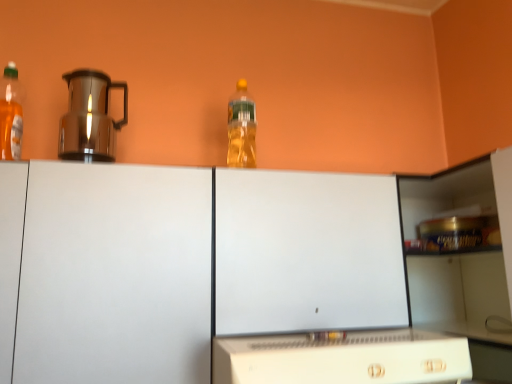
Question: Considering the positions of white matte cabinet at center and translucent plastic bottle at upper center, placed as the 1th bottle when sorted from right to left, in the image, is white matte cabinet at center taller or shorter than translucent plastic bottle at upper center, placed as the 1th bottle when sorted from right to left,?

Choices:
 (A) short
 (B) tall

Answer: (B)

Question: Looking at their shapes, would you say white matte cabinet at center is wider or thinner than translucent plastic bottle at upper center, the first bottle viewed from the back?

Choices:
 (A) thin
 (B) wide

Answer: (B)

Question: Considering the real-world distances, which object is farthest from the white plastic microwave at lower center?

Choices:
 (A) white matte cabinet at center
 (B) translucent plastic bottle at upper center, placed as the second bottle when sorted from left to right
 (C) translucent plastic bottle at left, arranged as the 2th bottle when viewed from the right
 (D) shiny metallic coffee pot at left

Answer: (C)

Question: Estimate the real-world distances between objects in this image. Which object is closer to the translucent plastic bottle at left, the 1th bottle viewed from the front?

Choices:
 (A) translucent plastic bottle at upper center, the first bottle viewed from the back
 (B) white matte cabinet at center
 (C) white plastic microwave at lower center
 (D) shiny metallic coffee pot at left

Answer: (D)